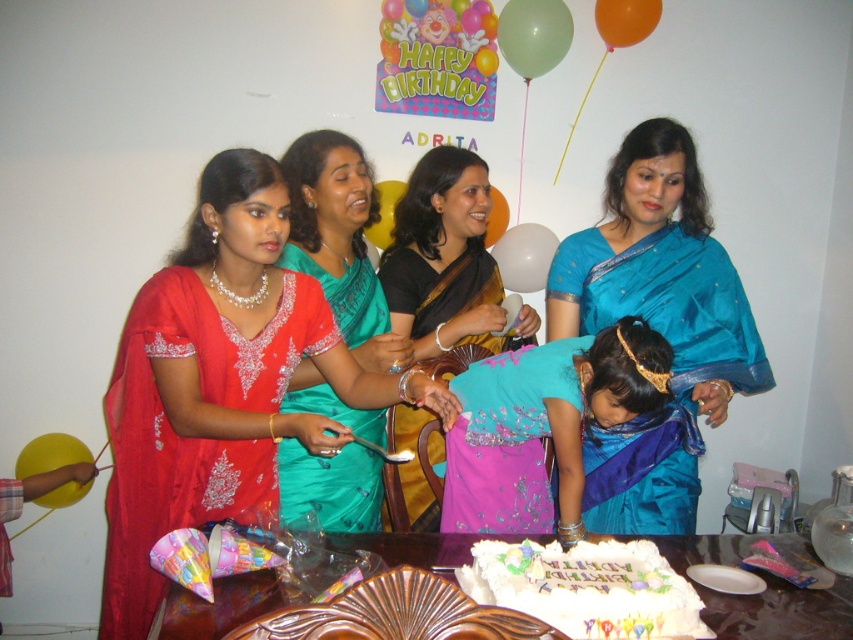
You are standing at the position of the camera and looking at the scene. There are two points marked in the image, one at coordinates point (436,224) and the other at point (227,595). Which point is closer to you?

Point (436,224) is further to the camera than point (227,595), so the point closer to you is point (227,595).

You are a guest at the birthday party and want to take a photo of the white frosted cake at center without the blue silk saree at center appearing in the frame. Is this possible?

The blue silk saree at center is above the white frosted cake at center, so you can adjust your angle or position to frame the cake without the saree by moving below the saree or using a lower viewpoint to exclude it from the shot.

You are a photographer holding a camera and want to take a picture of the turquoise satin dress at center. What is the minimum distance you need to move to ensure the camera is exactly 1.72 meters away from the dress?

The minimum distance you need to move is 0 meters because the camera is already 1.72 meters away from the turquoise satin dress at center according to the description.